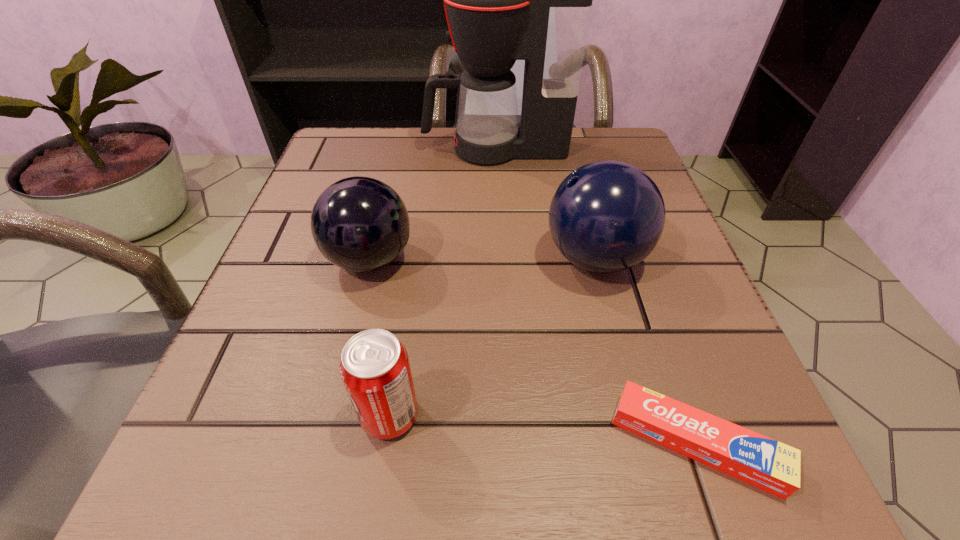
You are a GUI agent. You are given a task and a screenshot of the screen. Output one action in this format:
    pyautogui.click(x=<x>, y=<y>)
    Task: Click on the free space between the shorter bowling ball and the shortest object
    The width and height of the screenshot is (960, 540).
    Given the screenshot: What is the action you would take?
    533,351

I want to click on free space that is in between the tallest object and the shorter bowling ball, so click(x=432, y=204).

Where is `unoccupied area between the shortest object and the tallest object`? The width and height of the screenshot is (960, 540). unoccupied area between the shortest object and the tallest object is located at coordinates (595, 296).

Identify the location of vacant area that lies between the coffee maker and the right bowling ball. This screenshot has width=960, height=540. (544, 204).

Locate an element on the screen. This screenshot has height=540, width=960. vacant space that's between the coffee maker and the left bowling ball is located at coordinates (432, 204).

Find the location of a particular element. Image resolution: width=960 pixels, height=540 pixels. vacant space that is in between the tallest object and the right bowling ball is located at coordinates (544, 204).

The width and height of the screenshot is (960, 540). What are the coordinates of `free space between the shortest object and the left bowling ball` in the screenshot? It's located at (533, 351).

Identify which object is located as the second nearest to the soda. Please provide its 2D coordinates. Your answer should be formatted as a tuple, i.e. [(x, y)], where the tuple contains the x and y coordinates of a point satisfying the conditions above.

[(772, 466)]

Where is `object that is the nearest to the coffee maker`? The width and height of the screenshot is (960, 540). object that is the nearest to the coffee maker is located at coordinates (607, 216).

Where is `vacant area in the image that satisfies the following two spatial constraints: 1. on the surface of the shortest object near the finger holes; 2. on the left side of the right bowling ball`? vacant area in the image that satisfies the following two spatial constraints: 1. on the surface of the shortest object near the finger holes; 2. on the left side of the right bowling ball is located at coordinates (643, 443).